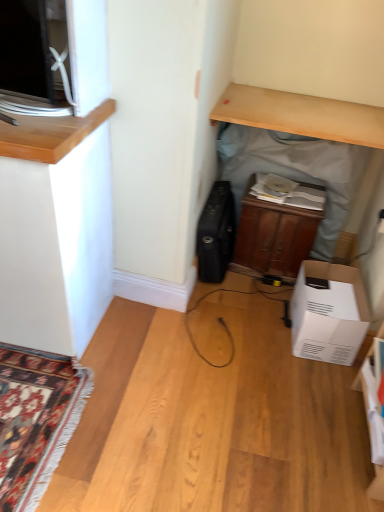
You are a GUI agent. You are given a task and a screenshot of the screen. Output one action in this format:
    pyautogui.click(x=<x>, y=<y>)
    Task: Click on the vacant space in front of wooden cabinet at center
    Image resolution: width=384 pixels, height=512 pixels.
    Given the screenshot: What is the action you would take?
    pyautogui.click(x=249, y=310)